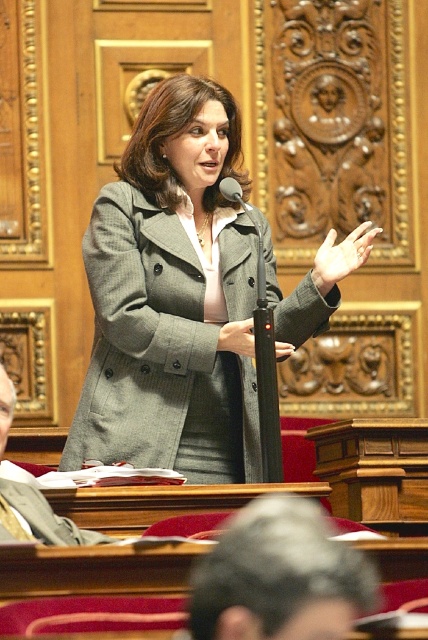
Can you confirm if gray wool coat at center is taller than matte gray coat at center?

Correct, gray wool coat at center is much taller as matte gray coat at center.

Locate an element on the screen. This screenshot has height=640, width=428. gray wool coat at center is located at coordinates [172, 298].

Image resolution: width=428 pixels, height=640 pixels. Find the location of `gray wool coat at center`. gray wool coat at center is located at coordinates (172, 298).